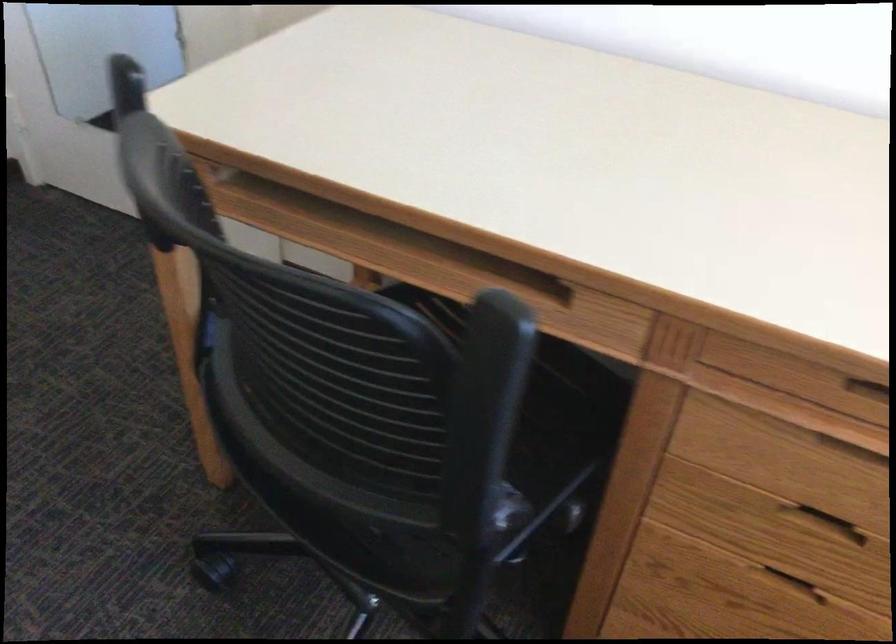
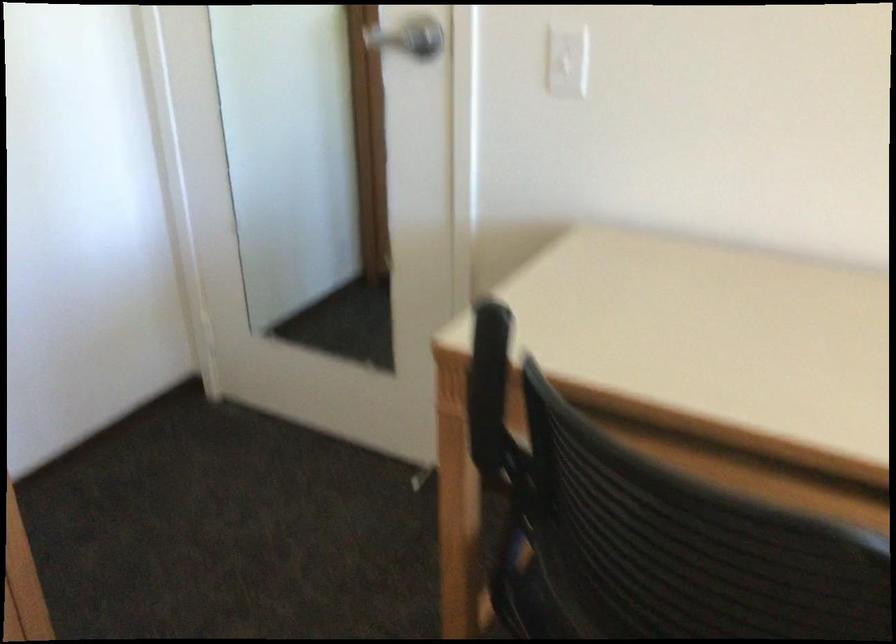
Question: In a continuous first-person perspective shot, in which direction is the camera moving?

Choices:
 (A) Left
 (B) Right
 (C) Forward
 (D) Backward

Answer: (A)